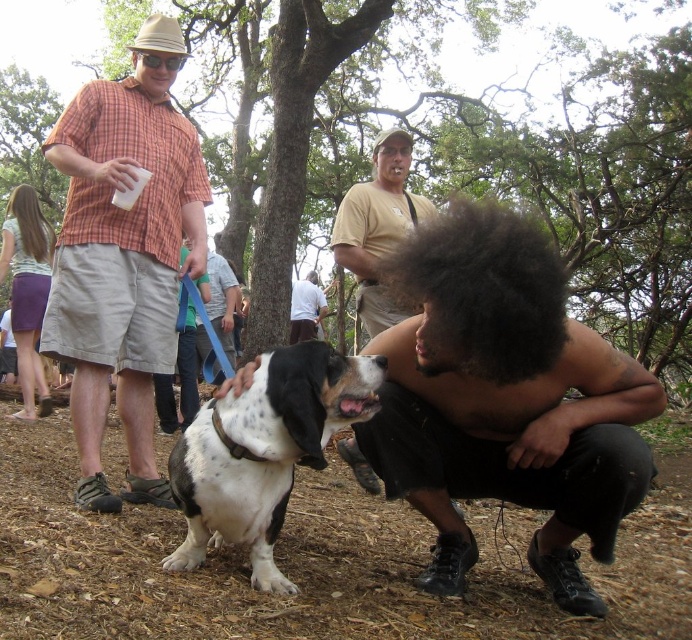
You are organizing a clothing donation drive and need to sort items based on their positions. If you have to pick up the plaid shirt at left and the tan cotton shirt at center, which one should you pick first to follow the leftmost rule?

The plaid shirt at left is positioned on the left side of tan cotton shirt at center, so you should pick the plaid shirt at left first to follow the leftmost rule.

In the scene shown: You are organizing a clothing donation drive and need to stack the plaid shirt at left and tan cotton shirt at center vertically. Which shirt should you place at the bottom to ensure stability?

The plaid shirt at left should be placed at the bottom because it is wider than the tan cotton shirt at center, providing a stable base for the stack.